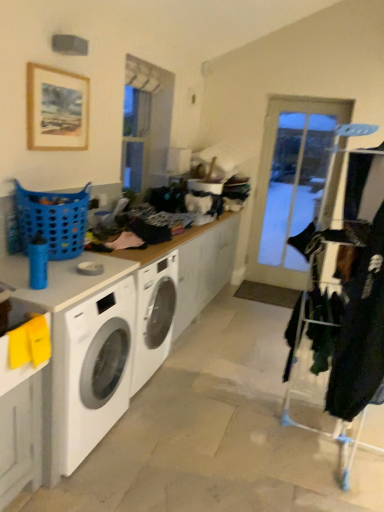
You are a GUI agent. You are given a task and a screenshot of the screen. Output one action in this format:
    pyautogui.click(x=<x>, y=<y>)
    Task: Click on the vacant area situated below metal/textured clothes rack at right (from a real-world perspective)
    Image resolution: width=384 pixels, height=512 pixels.
    Given the screenshot: What is the action you would take?
    pyautogui.click(x=327, y=442)